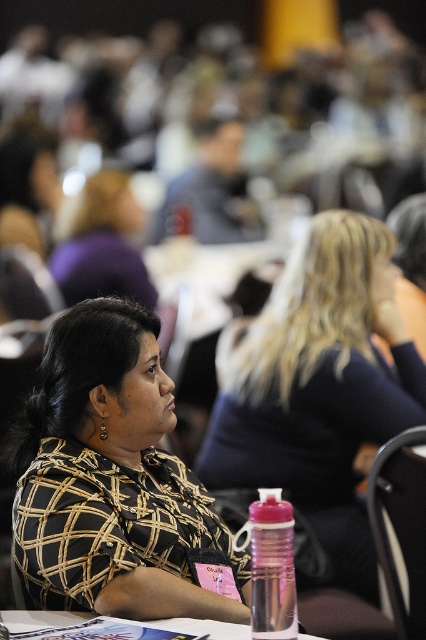
Question: Does printed fabric shirt at center have a smaller size compared to smooth black shirt at center?

Choices:
 (A) no
 (B) yes

Answer: (B)

Question: Is printed fabric shirt at center to the right of smooth black shirt at center from the viewer's perspective?

Choices:
 (A) yes
 (B) no

Answer: (B)

Question: Among these points, which one is nearest to the camera?

Choices:
 (A) (340, 282)
 (B) (129, 614)

Answer: (B)

Question: Does printed fabric shirt at center appear on the right side of smooth black shirt at center?

Choices:
 (A) yes
 (B) no

Answer: (B)